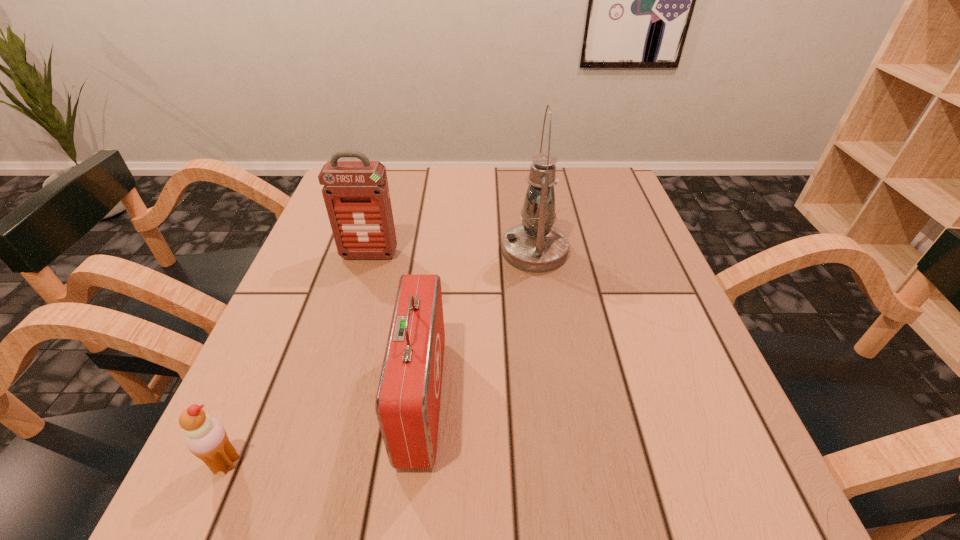
In the image, there is a desktop. Identify the location of free space at the near left corner. (262, 508).

The height and width of the screenshot is (540, 960). I want to click on free point at the far right corner, so click(611, 179).

At what (x,y) coordinates should I click in order to perform the action: click on vacant space in between the nearer first-aid kit and the rightmost object. Please return your answer as a coordinate pair (x, y). Looking at the image, I should click on [478, 325].

The image size is (960, 540). Find the location of `vacant space that's between the shorter first-aid kit and the icecream`. vacant space that's between the shorter first-aid kit and the icecream is located at coordinates (324, 431).

The width and height of the screenshot is (960, 540). I want to click on vacant area between the shortest object and the farther first-aid kit, so click(x=298, y=359).

This screenshot has width=960, height=540. In order to click on free space between the second shortest object and the rightmost object in this screenshot , I will do `click(478, 325)`.

Where is `vacant area between the taller first-aid kit and the leftmost object`? vacant area between the taller first-aid kit and the leftmost object is located at coordinates (298, 359).

Identify the location of free spot between the leftmost object and the third object from left to right. The image size is (960, 540). (324, 431).

Identify which object is the third nearest to the leftmost object. Please provide its 2D coordinates. Your answer should be formatted as a tuple, i.e. [(x, y)], where the tuple contains the x and y coordinates of a point satisfying the conditions above.

[(535, 246)]

The height and width of the screenshot is (540, 960). I want to click on object that is the second nearest to the third tallest object, so click(206, 438).